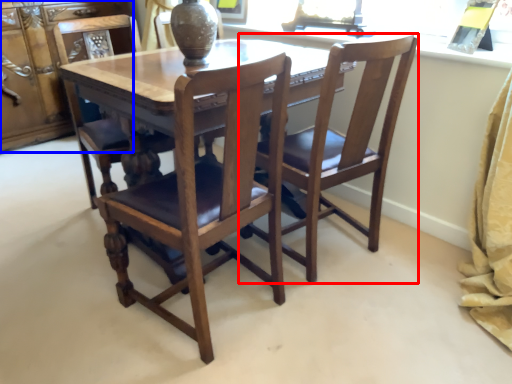
Question: Which of the following is the closest to the observer, chair (highlighted by a red box) or cabinetry (highlighted by a blue box)?

Choices:
 (A) chair
 (B) cabinetry

Answer: (A)